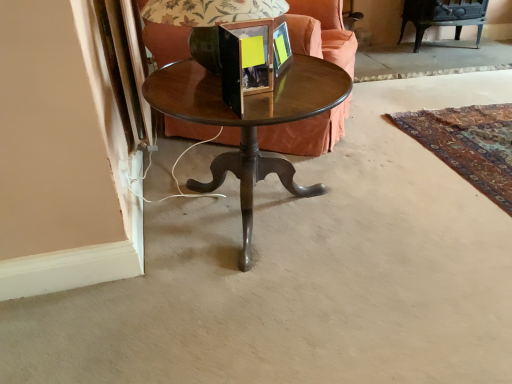
Identify the location of vacant region to the right of velvet orange couch at center. The image size is (512, 384). (389, 106).